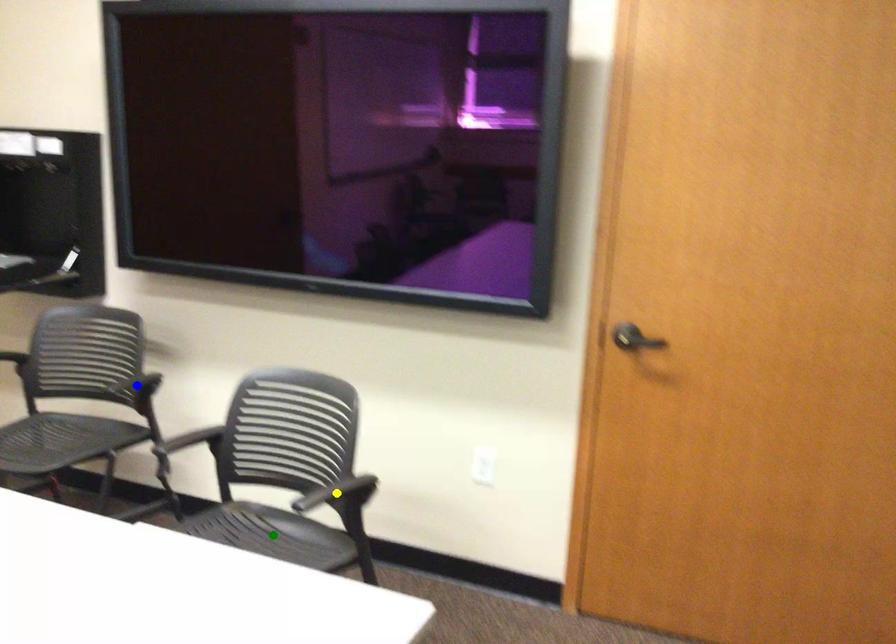
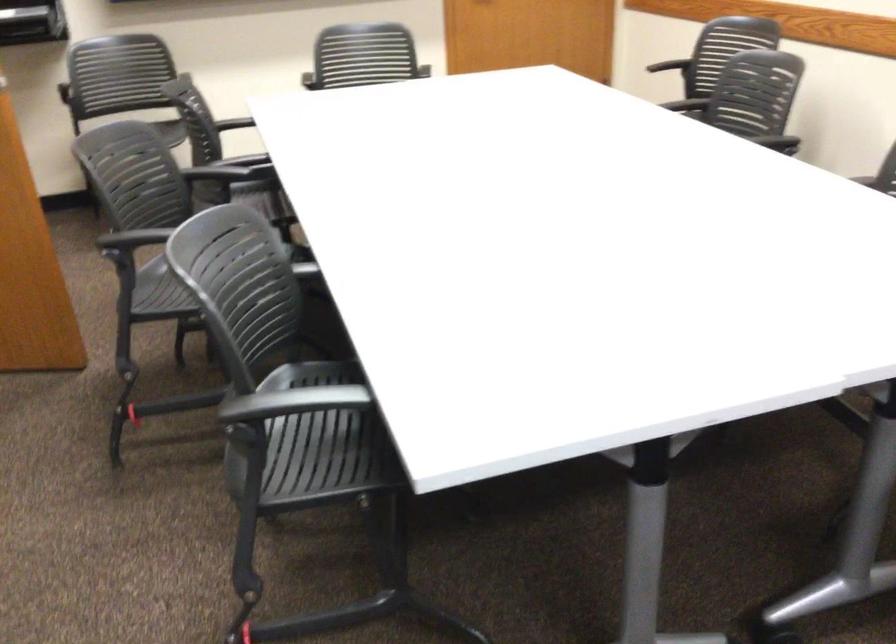
I am providing you with two images of the same scene from different viewpoints. Three points are marked in image1. Which point corresponds to a part or object that is occluded in image2?In image1, three points are marked. Which of them correspond to a part or object that is occluded in image2?Among the three points shown in image1, which one corresponds to a part or object that is no longer visible due to occlusion in image2?

Invisible in image2: blue point, green point, yellow point.